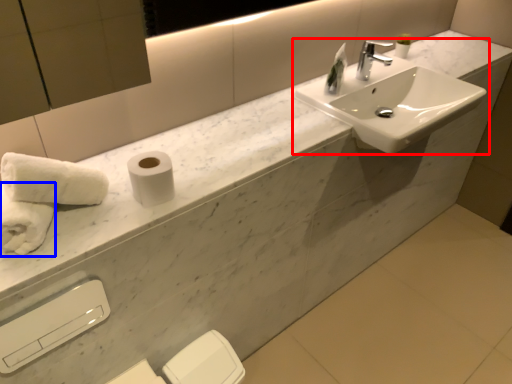
Question: Which point is closer to the camera, sink (highlighted by a red box) or bath towel (highlighted by a blue box)?

Choices:
 (A) sink
 (B) bath towel

Answer: (B)